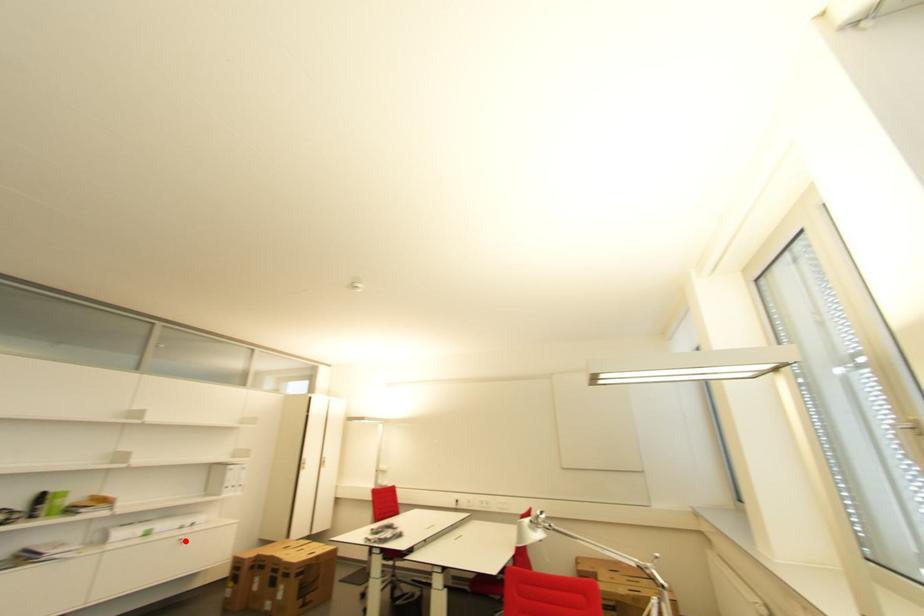
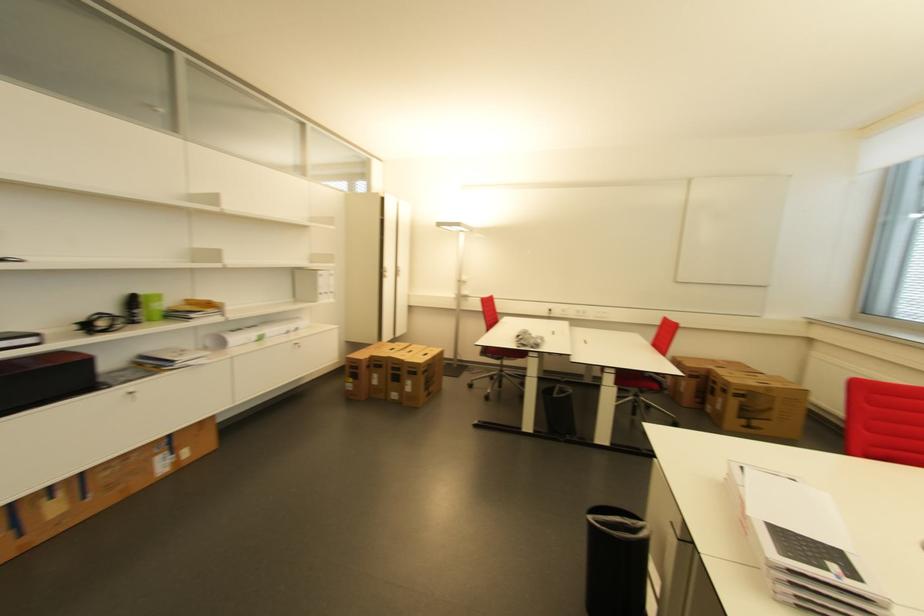
In the second image, find the point that corresponds to the highlighted location in the first image.

(300, 345)